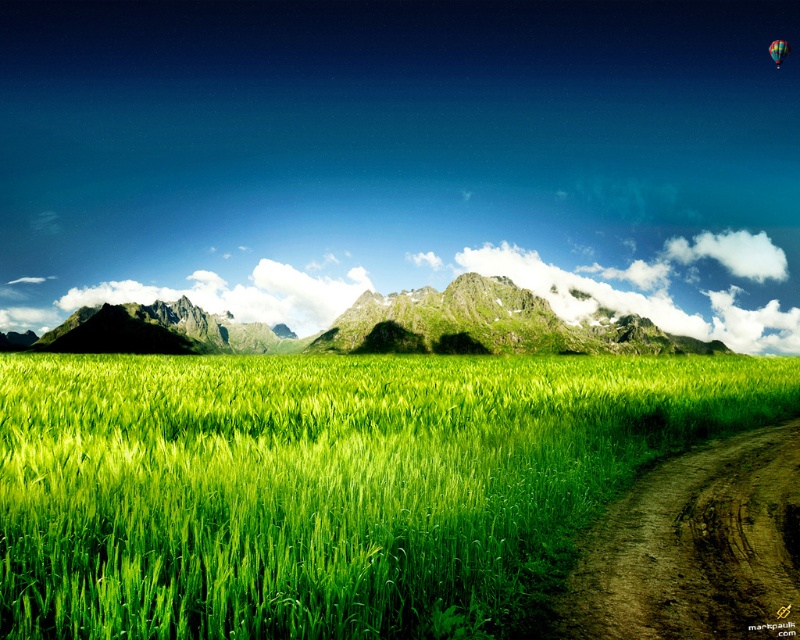
Can you confirm if green grassy wheat field at center is positioned to the left of green grassy mountain at center?

In fact, green grassy wheat field at center is to the right of green grassy mountain at center.

Is point (478, 451) behind point (413, 308)?

No, (478, 451) is closer to viewer.

What are the coordinates of `green grassy wheat field at center` in the screenshot? It's located at (328, 483).

Does green grassy wheat field at center appear under multicolored fabric balloon at upper right?

Yes.

Does point (64, 570) come behind point (788, 44)?

No, (64, 570) is in front of (788, 44).

This screenshot has width=800, height=640. I want to click on green grassy wheat field at center, so click(328, 483).

Can you confirm if green grassy mountain at center is positioned to the right of multicolored fabric balloon at upper right?

No, green grassy mountain at center is not to the right of multicolored fabric balloon at upper right.

Is point (178, 326) positioned before point (778, 67)?

No, it is behind (778, 67).

Find the location of a particular element. This screenshot has width=800, height=640. green grassy mountain at center is located at coordinates (378, 326).